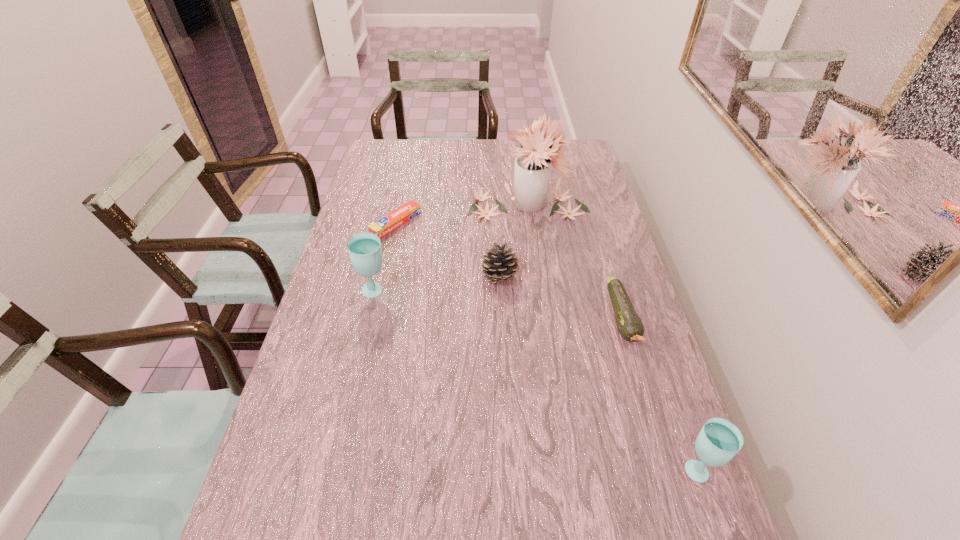
In order to click on vacant position located 0.320m on the back of the bouquet in this screenshot , I will do coord(519,141).

The image size is (960, 540). I want to click on vacant space located at the blossom end of the zucchini, so click(x=680, y=510).

This screenshot has height=540, width=960. In order to click on free region located on the front of the toothpaste in this screenshot , I will do `click(388, 263)`.

The image size is (960, 540). I want to click on vacant region located on the front of the third shortest object, so click(x=502, y=337).

Find the location of a particular element. glass located in the left edge section of the desktop is located at coordinates (364, 249).

I want to click on toothpaste at the left edge, so click(388, 223).

You are a GUI agent. You are given a task and a screenshot of the screen. Output one action in this format:
    pyautogui.click(x=<x>, y=<y>)
    Task: Click on the glass present at the right edge
    
    Given the screenshot: What is the action you would take?
    pyautogui.click(x=719, y=441)

The width and height of the screenshot is (960, 540). Identify the location of bouquet located at the right edge. (532, 166).

The image size is (960, 540). What are the coordinates of `zucchini that is at the right edge` in the screenshot? It's located at (629, 324).

Where is `vacant region at the far edge`? The height and width of the screenshot is (540, 960). vacant region at the far edge is located at coordinates (420, 139).